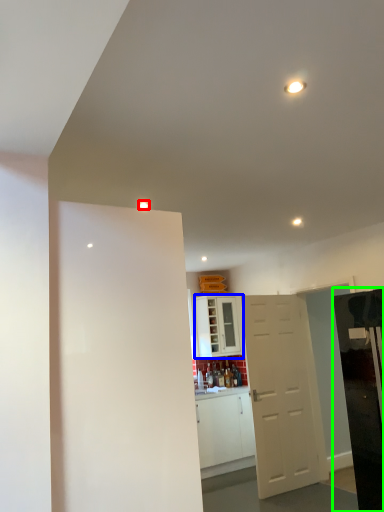
Question: Which object is the farthest from light (highlighted by a red box)? Choose among these: cabinetry (highlighted by a blue box) or appliance (highlighted by a green box).

Choices:
 (A) cabinetry
 (B) appliance

Answer: (A)